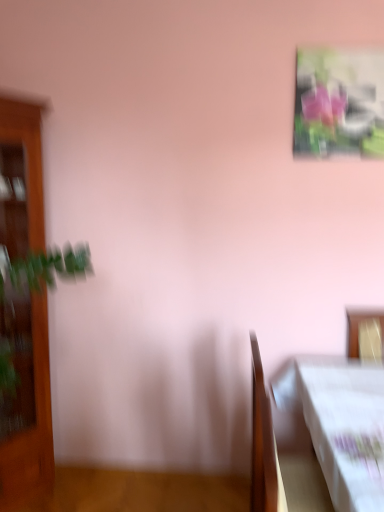
Identify the location of wooden cabinet at left. (28, 408).

Find the location of a particular element. The image size is (384, 512). metallic glossy picture frame at upper right is located at coordinates (339, 102).

Is wooden table at lower right looking in the opposite direction of metallic glossy picture frame at upper right?

That's not correct — wooden table at lower right is not looking away from metallic glossy picture frame at upper right.

From a real-world perspective, is wooden table at lower right below metallic glossy picture frame at upper right?

Yes, from a real-world perspective, wooden table at lower right is below metallic glossy picture frame at upper right.

Which is in front, point (376, 433) or point (341, 142)?

Positioned in front is point (376, 433).

From the image's perspective, relative to metallic glossy picture frame at upper right, is wooden table at lower right above or below?

Clearly, from the image's perspective, wooden table at lower right is below metallic glossy picture frame at upper right.

Is wooden cabinet at left thinner than metallic glossy picture frame at upper right?

No.

The image size is (384, 512). Find the location of `furniture that appears on the left of metallic glossy picture frame at upper right`. furniture that appears on the left of metallic glossy picture frame at upper right is located at coordinates (28, 408).

Is wooden cabinet at left facing towards metallic glossy picture frame at upper right?

No, wooden cabinet at left is not turned towards metallic glossy picture frame at upper right.

Is wooden cabinet at left not near metallic glossy picture frame at upper right?

wooden cabinet at left is positioned a significant distance from metallic glossy picture frame at upper right.

From the image's perspective, does metallic glossy picture frame at upper right appear lower than wooden table at lower right?

No.

In the image, is metallic glossy picture frame at upper right positioned in front of or behind wooden table at lower right?

In the image, metallic glossy picture frame at upper right appears behind wooden table at lower right.

Does metallic glossy picture frame at upper right have a smaller size compared to wooden table at lower right?

Indeed, metallic glossy picture frame at upper right has a smaller size compared to wooden table at lower right.

Does point (381, 136) appear closer or farther from the camera than point (304, 385)?

Point (381, 136) is positioned farther from the camera compared to point (304, 385).

Can you confirm if metallic glossy picture frame at upper right is smaller than wooden cabinet at left?

Yes.

From a real-world perspective, is metallic glossy picture frame at upper right located beneath wooden cabinet at left?

No, from a real-world perspective, metallic glossy picture frame at upper right is not under wooden cabinet at left.

Which is further, (360, 106) or (26, 361)?

The point (26, 361) is farther from the camera.

Considering the positions of objects metallic glossy picture frame at upper right and wooden cabinet at left in the image provided, who is in front, metallic glossy picture frame at upper right or wooden cabinet at left?

Positioned in front is wooden cabinet at left.

Which is behind, wooden table at lower right or wooden cabinet at left?

wooden cabinet at left.

Is wooden table at lower right inside or outside of wooden cabinet at left?

wooden table at lower right exists outside the volume of wooden cabinet at left.

From the image's perspective, is wooden table at lower right located above wooden cabinet at left?

No, from the image's perspective, wooden table at lower right is not above wooden cabinet at left.

Does wooden cabinet at left have a lesser height compared to wooden table at lower right?

Incorrect, the height of wooden cabinet at left does not fall short of that of wooden table at lower right.

Can you confirm if wooden cabinet at left is bigger than wooden table at lower right?

Yes, wooden cabinet at left is bigger than wooden table at lower right.

Between wooden cabinet at left and wooden table at lower right, which one appears on the right side from the viewer's perspective?

wooden table at lower right.

From the image's perspective, which is below, wooden cabinet at left or wooden table at lower right?

wooden table at lower right.

Find the location of a particular element. The image size is (384, 512). picture frame located above the wooden table at lower right (from the image's perspective) is located at coordinates (339, 102).

Where is `furniture lying in front of the metallic glossy picture frame at upper right`? furniture lying in front of the metallic glossy picture frame at upper right is located at coordinates (x=28, y=408).

When comparing their distances from wooden cabinet at left, does wooden table at lower right or metallic glossy picture frame at upper right seem closer?

wooden table at lower right.

Based on their spatial positions, is metallic glossy picture frame at upper right or wooden cabinet at left closer to wooden table at lower right?

metallic glossy picture frame at upper right lies closer to wooden table at lower right than the other object.

Based on their spatial positions, is metallic glossy picture frame at upper right or wooden table at lower right closer to wooden cabinet at left?

wooden table at lower right is positioned closer to the anchor wooden cabinet at left.

Based on the photo, estimate the real-world distances between objects in this image. Which object is closer to wooden table at lower right, wooden cabinet at left or metallic glossy picture frame at upper right?

metallic glossy picture frame at upper right.

From the image, which object appears to be farther from metallic glossy picture frame at upper right, wooden table at lower right or wooden cabinet at left?

The object further to metallic glossy picture frame at upper right is wooden cabinet at left.

Estimate the real-world distances between objects in this image. Which object is further from metallic glossy picture frame at upper right, wooden cabinet at left or wooden table at lower right?

Among the two, wooden cabinet at left is located further to metallic glossy picture frame at upper right.

Locate an element on the screen. This screenshot has width=384, height=512. table situated between wooden cabinet at left and metallic glossy picture frame at upper right from left to right is located at coordinates (340, 423).